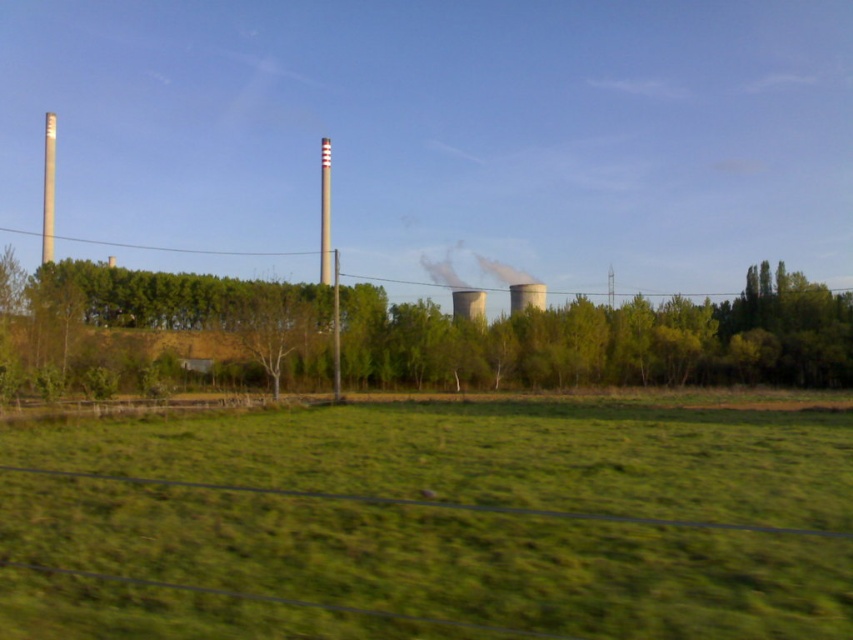
You are standing in a rural landscape with a green field and trees. You notice a smoketransparentsteam at center. Based on its coordinates, can you determine if it is closer to the foreground or the midground?

The smoketransparentsteam at center is located at point [476,266], which places it closer to the midground since the foreground is lower in the image.

You are standing in the rural landscape and see a point marked at coordinates (x=602, y=340). According to the image description, where is this point located?

The point is located on the green leafy tree at center.

You are standing at the origin point of the image. Which direction should you move to reach the green leafy tree at center?

The green leafy tree at center is located at coordinates approximately 0.534 on the x axis and 0.708 on the y axis, so you should move towards the center of the image slightly to the right and upward to reach it.